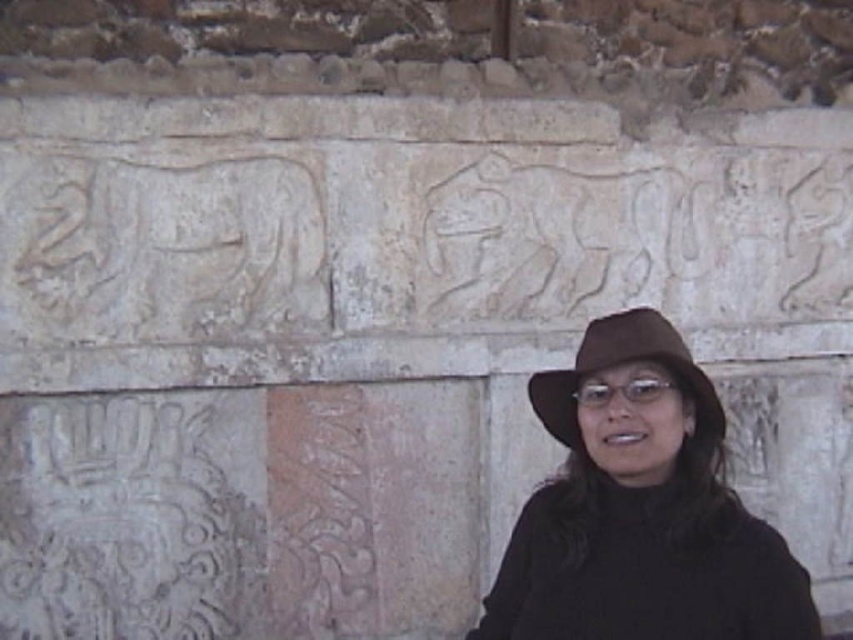
Is black felt hat at center bigger than brown felt fedora at center?

Yes.

Does point (766, 538) come farther from viewer compared to point (541, 378)?

That is False.

Image resolution: width=853 pixels, height=640 pixels. I want to click on black felt hat at center, so click(x=640, y=509).